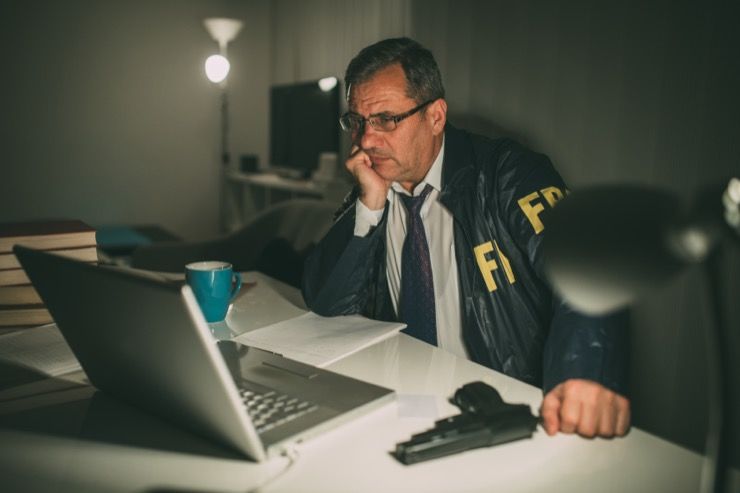
Image resolution: width=740 pixels, height=493 pixels. I want to click on books, so click(x=6, y=243), click(x=7, y=259), click(x=10, y=276), click(x=15, y=292), click(x=23, y=314).